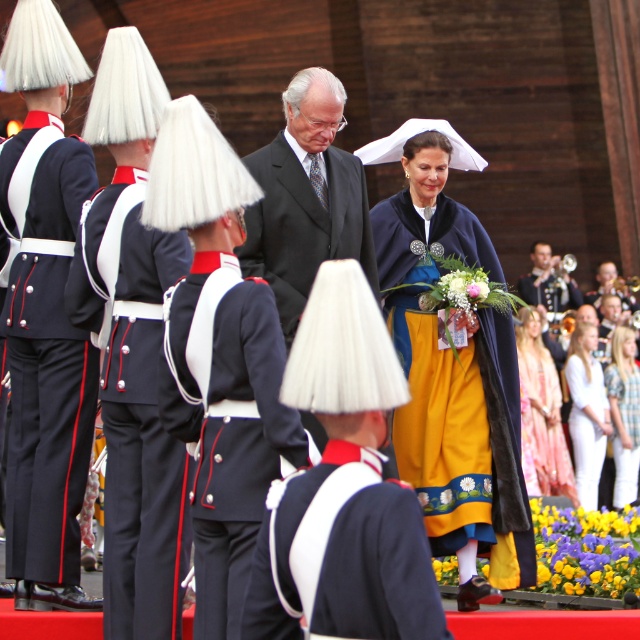
Can you confirm if white matte dress at lower right is smaller than yellow satin dress at center?

No, white matte dress at lower right is not smaller than yellow satin dress at center.

Consider the image. Which is more to the left, white matte dress at lower right or yellow satin dress at center?

white matte dress at lower right is more to the left.

You are a GUI agent. You are given a task and a screenshot of the screen. Output one action in this format:
    pyautogui.click(x=<x>, y=<y>)
    Task: Click on the white matte dress at lower right
    This screenshot has height=640, width=640.
    Given the screenshot: What is the action you would take?
    pyautogui.click(x=586, y=412)

Is navy blue wool uniform at center to the left of shiny silver trumpet at right from the viewer's perspective?

Correct, you'll find navy blue wool uniform at center to the left of shiny silver trumpet at right.

Is navy blue wool uniform at center positioned behind shiny silver trumpet at right?

That is False.

Who is more distant from viewer, (328, 476) or (563, 285)?

Point (563, 285)

Identify the location of navy blue wool uniform at center. This screenshot has width=640, height=640. (342, 556).

Which is more to the left, navy blue fabric trousers at left or smooth gold trumpet at right?

navy blue fabric trousers at left

Does navy blue fabric trousers at left have a larger size compared to smooth gold trumpet at right?

Yes, navy blue fabric trousers at left is bigger than smooth gold trumpet at right.

Is point (150, 566) positioned after point (602, 291)?

No, (150, 566) is closer to viewer.

Locate an element on the screen. This screenshot has height=640, width=640. navy blue fabric trousers at left is located at coordinates (141, 445).